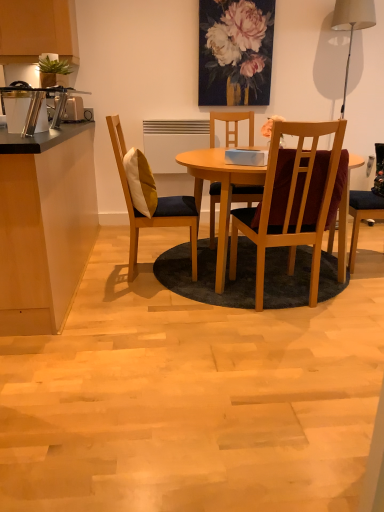
Question: Considering the relative sizes of white fabric lampshade at upper right and black laminate countertop at left in the image provided, is white fabric lampshade at upper right wider than black laminate countertop at left?

Choices:
 (A) yes
 (B) no

Answer: (B)

Question: Can you confirm if white fabric lampshade at upper right is smaller than black laminate countertop at left?

Choices:
 (A) no
 (B) yes

Answer: (B)

Question: Would you say white fabric lampshade at upper right is outside black laminate countertop at left?

Choices:
 (A) no
 (B) yes

Answer: (B)

Question: Does white fabric lampshade at upper right lie in front of black laminate countertop at left?

Choices:
 (A) yes
 (B) no

Answer: (B)

Question: Considering the relative sizes of white fabric lampshade at upper right and black laminate countertop at left in the image provided, is white fabric lampshade at upper right shorter than black laminate countertop at left?

Choices:
 (A) no
 (B) yes

Answer: (A)

Question: Does white fabric lampshade at upper right appear on the left side of black laminate countertop at left?

Choices:
 (A) no
 (B) yes

Answer: (A)

Question: Can you confirm if silver metallic toaster at left is wider than wooden table at center?

Choices:
 (A) yes
 (B) no

Answer: (B)

Question: Is silver metallic toaster at left next to wooden table at center?

Choices:
 (A) yes
 (B) no

Answer: (B)

Question: Can you confirm if silver metallic toaster at left is taller than wooden table at center?

Choices:
 (A) no
 (B) yes

Answer: (A)

Question: Can you confirm if silver metallic toaster at left is thinner than wooden table at center?

Choices:
 (A) yes
 (B) no

Answer: (A)

Question: Can you confirm if silver metallic toaster at left is bigger than wooden table at center?

Choices:
 (A) yes
 (B) no

Answer: (B)

Question: Is silver metallic toaster at left looking in the opposite direction of wooden table at center?

Choices:
 (A) yes
 (B) no

Answer: (B)

Question: Can you confirm if white fabric lampshade at upper right is wider than wooden chair at center, arranged as the 1th chair when viewed from the right?

Choices:
 (A) yes
 (B) no

Answer: (B)